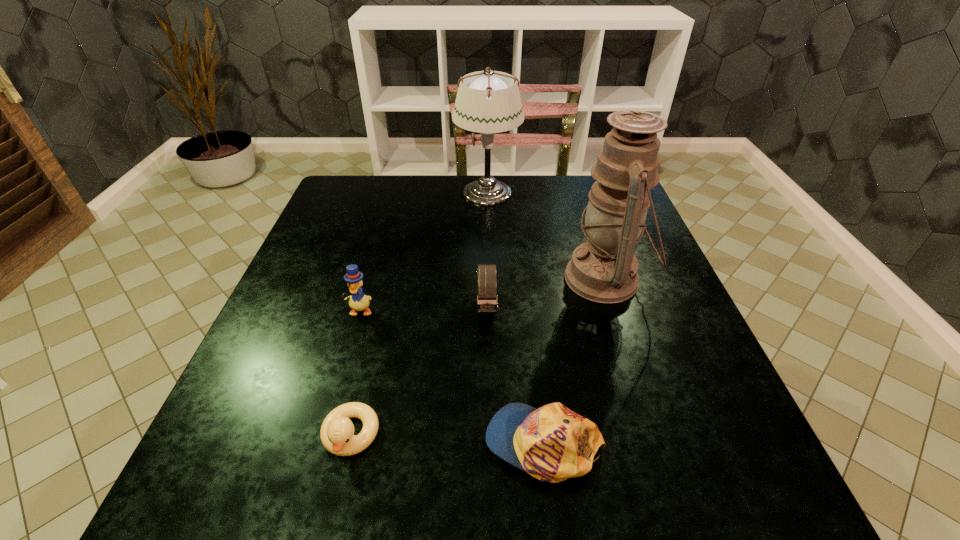
Find the location of a particular element. This screenshot has width=960, height=540. vacant space in between the shorter duckling and the farther duckling is located at coordinates (355, 373).

Image resolution: width=960 pixels, height=540 pixels. Identify the location of vacant space that's between the nearer duckling and the oil lamp. (478, 357).

Locate an element on the screen. free spot between the oil lamp and the lampshade is located at coordinates (546, 235).

Locate an element on the screen. The width and height of the screenshot is (960, 540). vacant space that's between the oil lamp and the shorter duckling is located at coordinates (478, 357).

This screenshot has height=540, width=960. What are the coordinates of `empty space that is in between the watch and the shorter duckling` in the screenshot? It's located at (419, 372).

Where is `vacant area between the nearer duckling and the oil lamp`? This screenshot has height=540, width=960. vacant area between the nearer duckling and the oil lamp is located at coordinates (478, 357).

Identify the location of free space that is in between the farther duckling and the cap. (452, 377).

Locate an element on the screen. This screenshot has width=960, height=540. the third closest object to the shorter duckling is located at coordinates (487, 303).

Identify which object is located as the third nearest to the taller duckling. Please provide its 2D coordinates. Your answer should be formatted as a tuple, i.e. [(x, y)], where the tuple contains the x and y coordinates of a point satisfying the conditions above.

[(552, 443)]

Find the location of `vacant region that satisfies the following two spatial constraints: 1. on the lampshade of the farthest object; 2. on the back side of the oil lamp`. vacant region that satisfies the following two spatial constraints: 1. on the lampshade of the farthest object; 2. on the back side of the oil lamp is located at coordinates (490, 279).